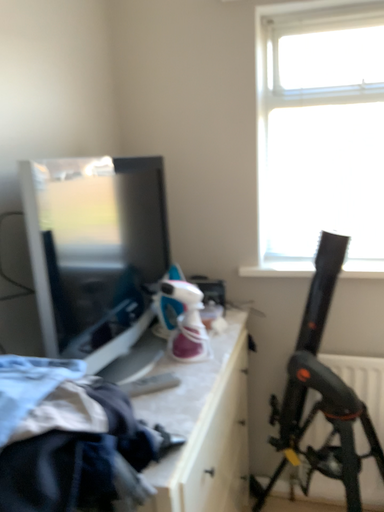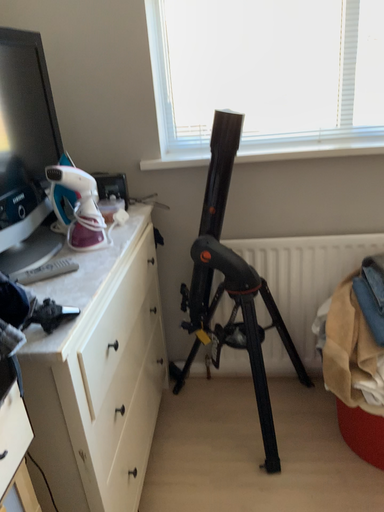
Question: Which way did the camera rotate in the video?

Choices:
 (A) rotated left
 (B) rotated right

Answer: (B)